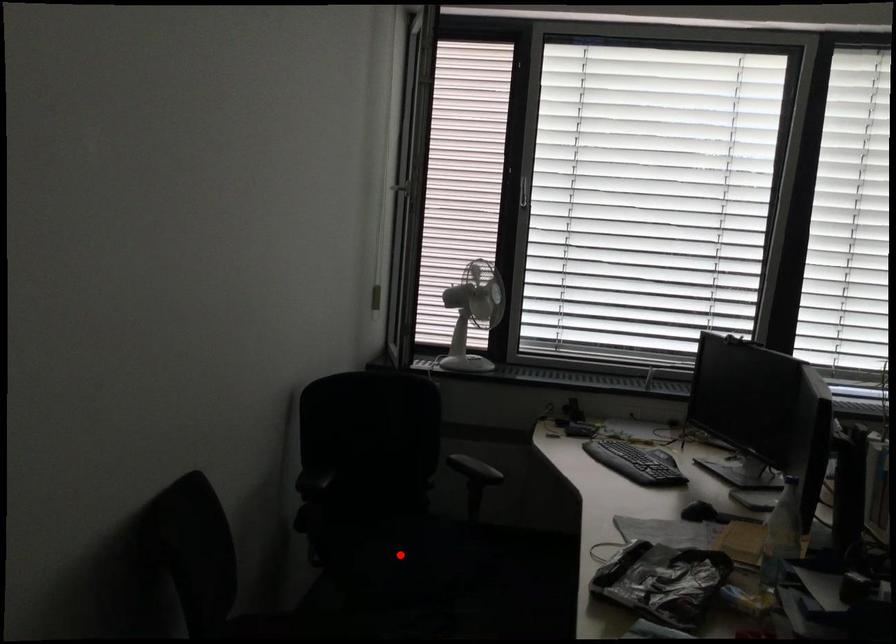
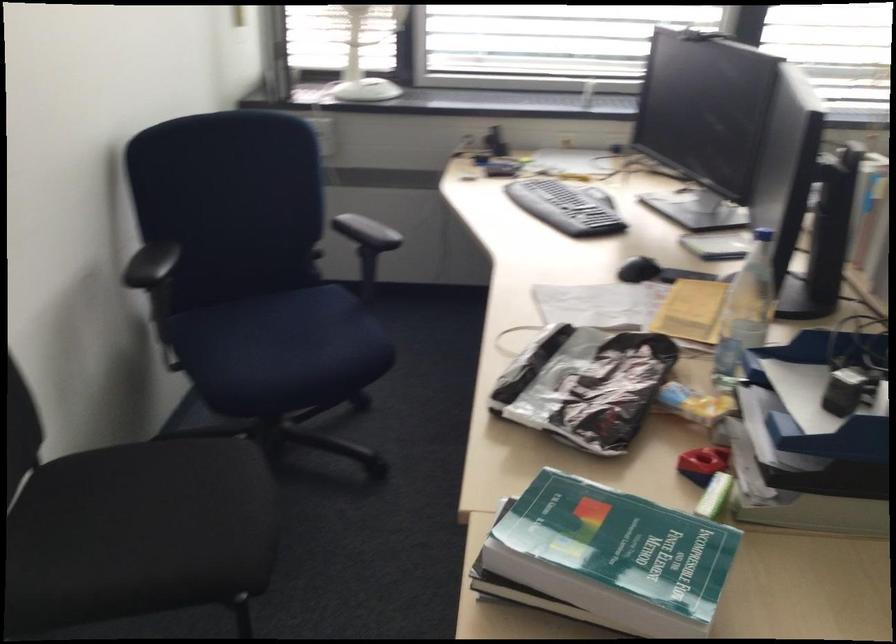
Question: A red point is marked in image1. In image2, is the corresponding 3D point closer to the camera or farther? Reply with the corresponding letter.

Choices:
 (A) The corresponding 3D point is closer.
 (B) The corresponding 3D point is farther.

Answer: (A)